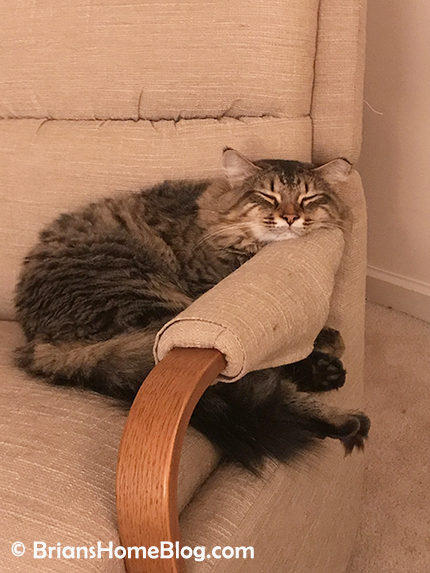
The width and height of the screenshot is (430, 573). In order to click on the armrest in this screenshot , I will do `click(141, 478)`.